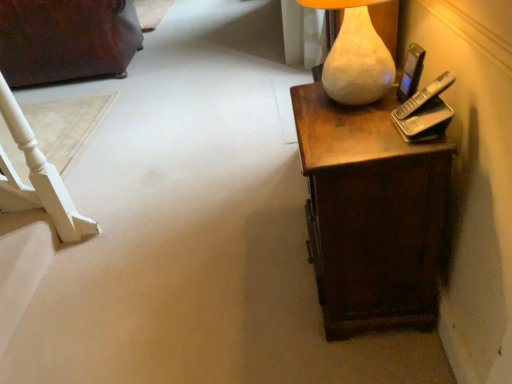
Where is `vacant space that is to the left of black plastic mobile phone at upper right`? Image resolution: width=512 pixels, height=384 pixels. vacant space that is to the left of black plastic mobile phone at upper right is located at coordinates (359, 116).